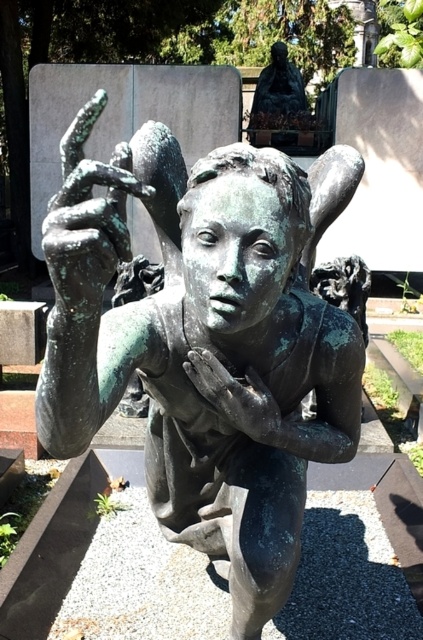
You are standing in front of the bronze sculpture of a young boy in the cemetery. You notice two points on the statue labeled as point (180, 205) and point (279, 83). Which of these points is nearer to you?

Point (180, 205) is closer to the viewer than point (279, 83).